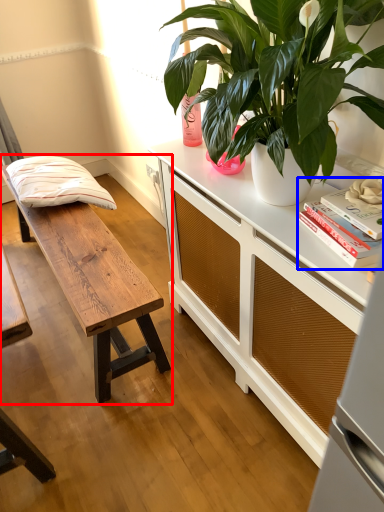
Question: Which of the following is the closest to the observer, table (highlighted by a red box) or book (highlighted by a blue box)?

Choices:
 (A) table
 (B) book

Answer: (B)